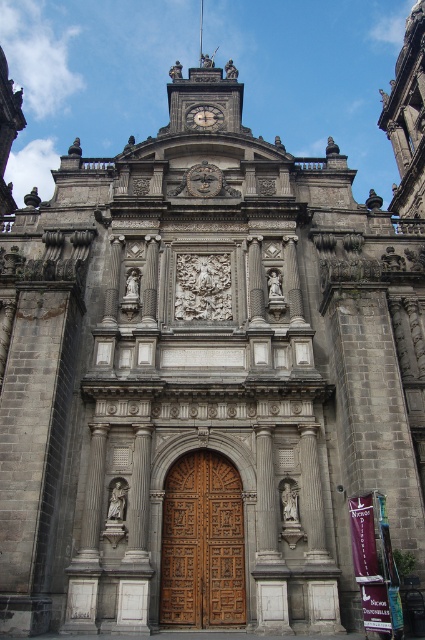
Does wooden carved door at center have a larger size compared to white stone clock at center?

Correct, wooden carved door at center is larger in size than white stone clock at center.

Who is positioned more to the right, wooden carved door at center or white stone clock at center?

Positioned to the right is white stone clock at center.

Does point (198, 612) lie behind point (210, 166)?

No, it is not.

The height and width of the screenshot is (640, 425). Find the location of `wooden carved door at center`. wooden carved door at center is located at coordinates (203, 544).

Between point (209, 468) and point (217, 113), which one is positioned in front?

Point (209, 468)

Which is more to the left, wooden carved door at center or silver metallic clock at upper center?

silver metallic clock at upper center

The image size is (425, 640). Describe the element at coordinates (203, 544) in the screenshot. I see `wooden carved door at center` at that location.

What are the coordinates of `wooden carved door at center` in the screenshot? It's located at (203, 544).

Between point (192, 180) and point (204, 104), which one is positioned in front?

Positioned in front is point (192, 180).

Between point (209, 180) and point (186, 120), which one is positioned behind?

The point (186, 120) is more distant.

At what (x,y) coordinates should I click in order to perform the action: click on white stone clock at center. Please return your answer as a coordinate pair (x, y). The height and width of the screenshot is (640, 425). Looking at the image, I should click on (204, 179).